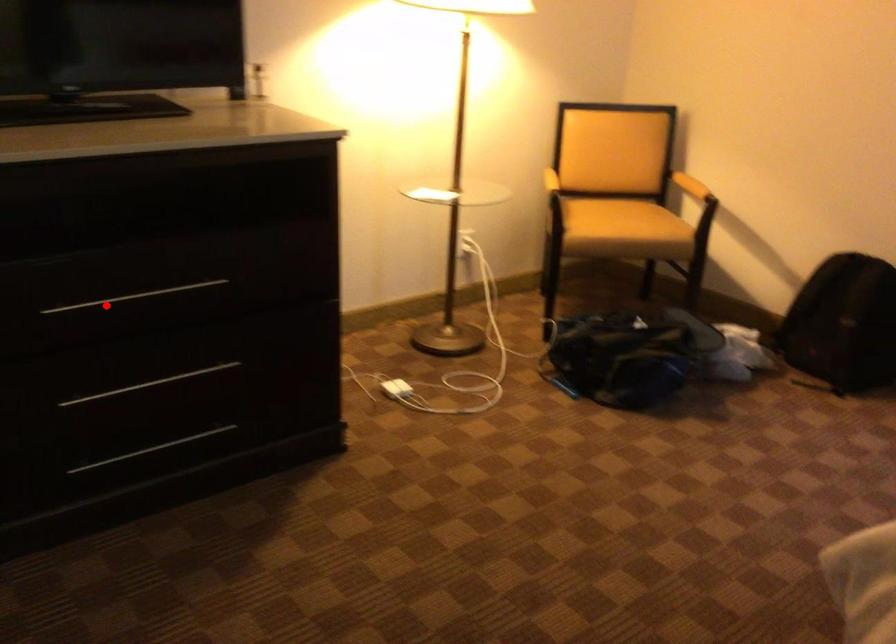
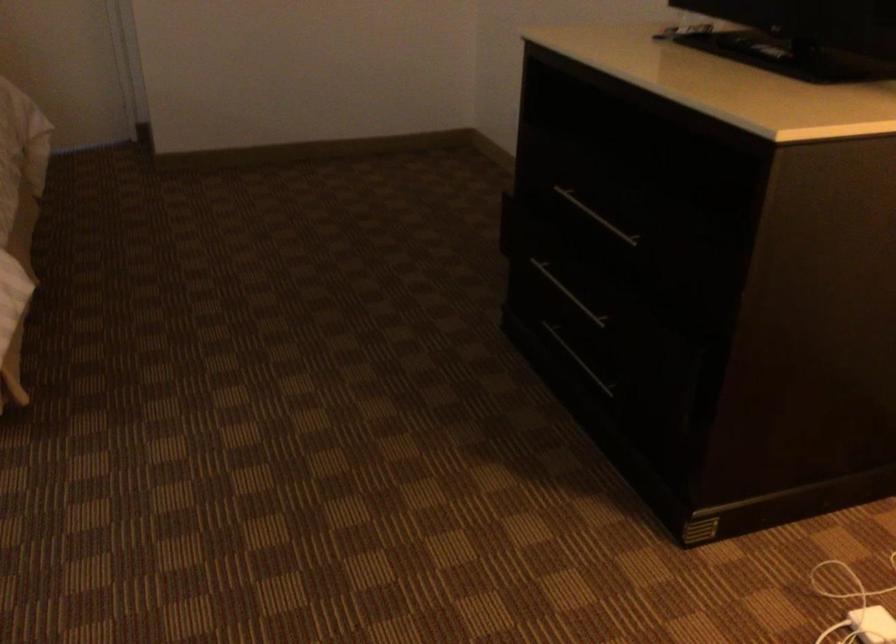
Where in the second image is the point corresponding to the highlighted location from the first image?

(596, 216)